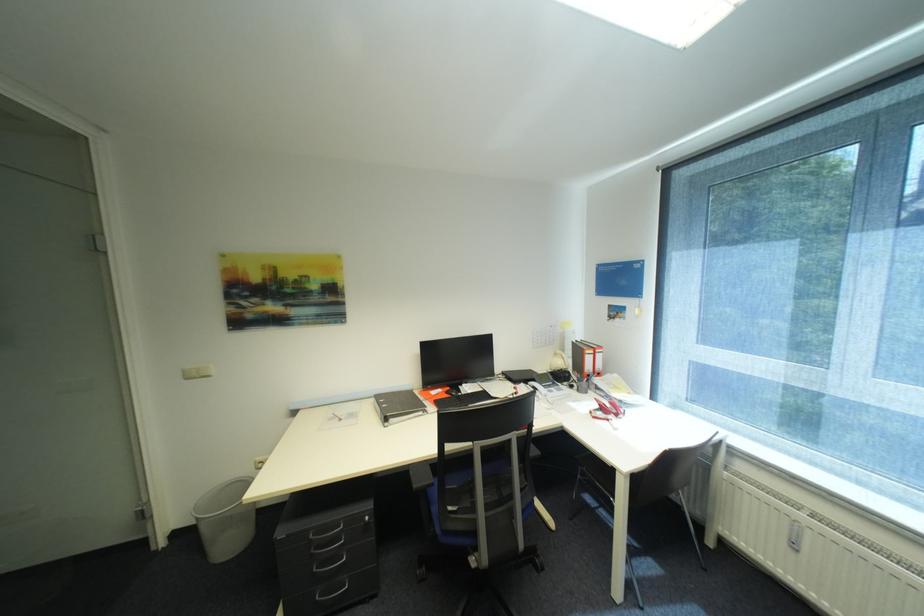
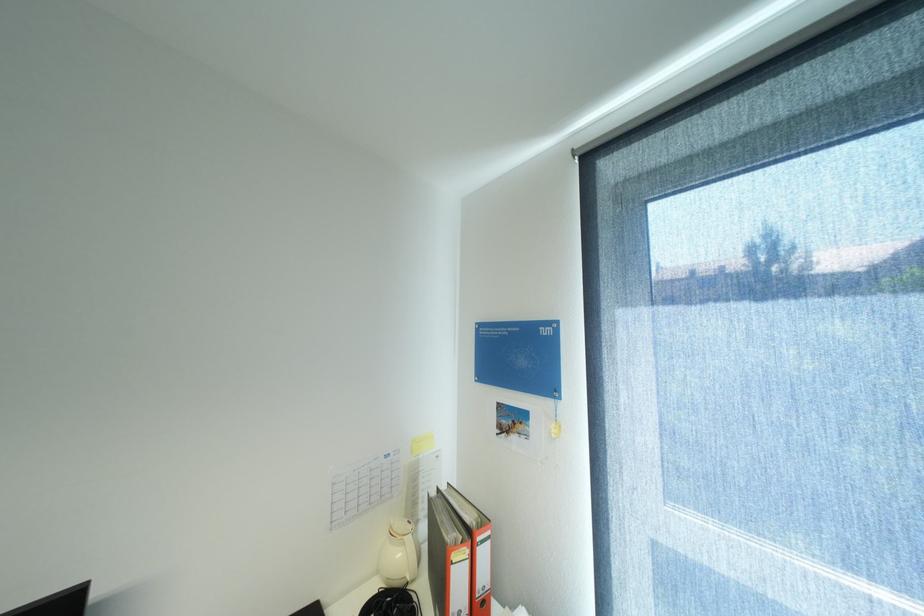
Where in the second image is the point corresponding to (567,363) from the first image?

(407, 554)